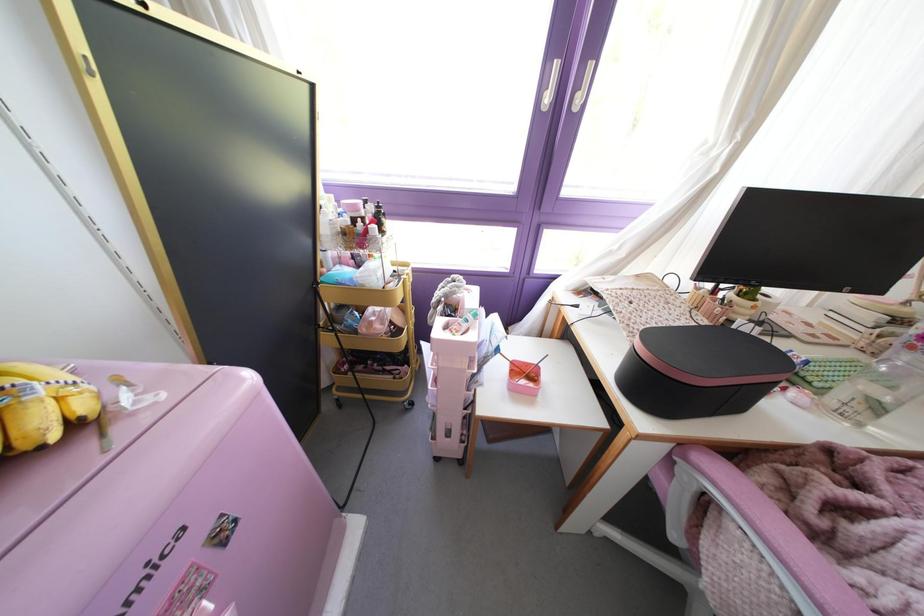
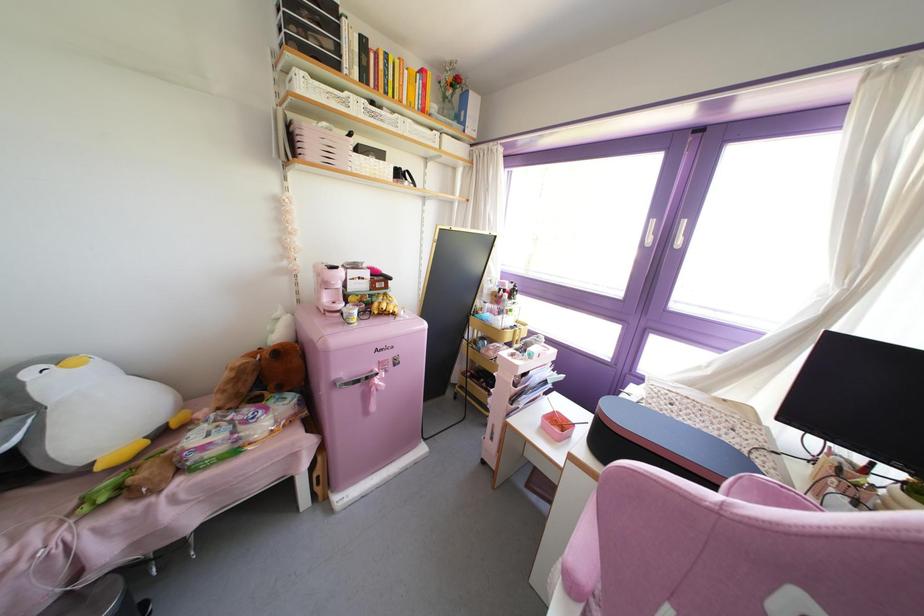
The point at (204,589) is marked in the first image. Where is the corresponding point in the second image?

(385, 371)